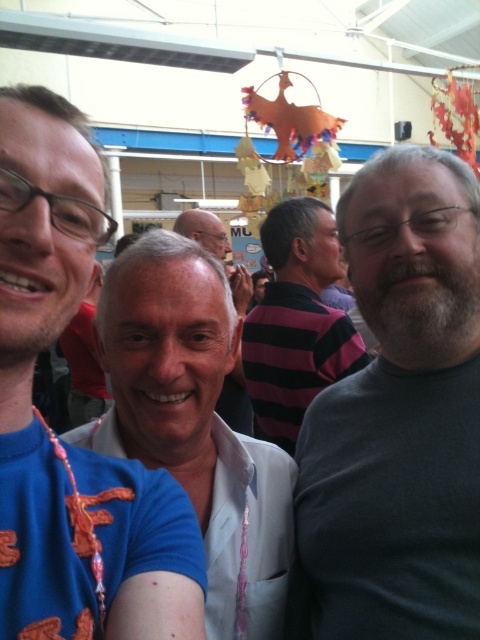
Question: Which object is positioned closest to the striped fabric shirt at center?

Choices:
 (A) dark gray t-shirt at right
 (B) white glossy shirt at center

Answer: (A)

Question: Can you confirm if dark gray t-shirt at right is positioned above blue fabric shirt at left?

Choices:
 (A) no
 (B) yes

Answer: (A)

Question: In this image, where is dark gray t-shirt at right located relative to white glossy shirt at center?

Choices:
 (A) left
 (B) right

Answer: (B)

Question: Which point is farther from the camera taking this photo?

Choices:
 (A) (79, 113)
 (B) (434, 444)

Answer: (B)

Question: Can you confirm if blue fabric shirt at left is wider than white glossy shirt at center?

Choices:
 (A) yes
 (B) no

Answer: (B)

Question: Among these objects, which one is nearest to the camera?

Choices:
 (A) white matte shirt at center
 (B) white glossy shirt at center
 (C) striped fabric shirt at center
 (D) blue fabric shirt at left

Answer: (D)